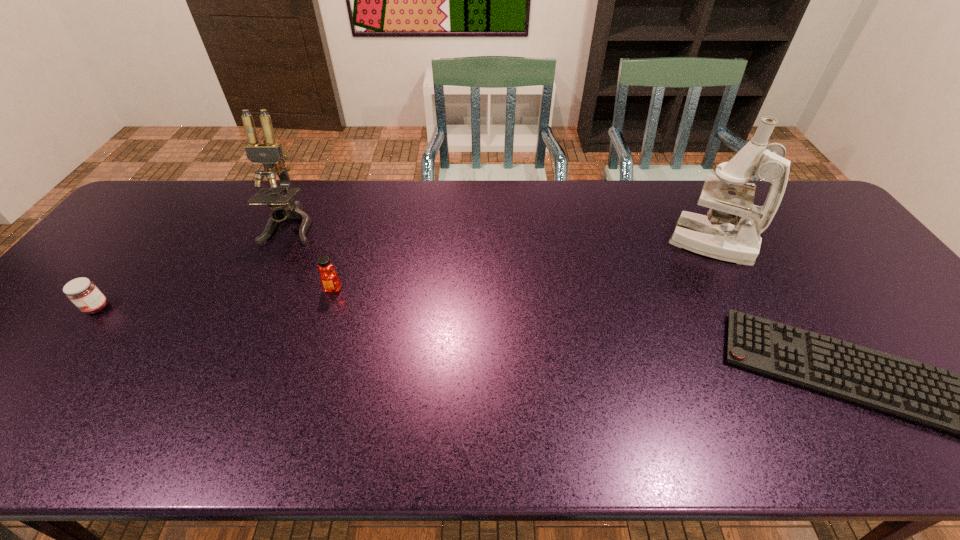
The image size is (960, 540). Identify the location of the right microscope. (713, 236).

Identify the location of the fourth object from right to left. pyautogui.click(x=269, y=153).

At what (x,y) coordinates should I click in order to perform the action: click on the third object from left to right. Please return your answer as a coordinate pair (x, y). The image size is (960, 540). Looking at the image, I should click on (329, 279).

This screenshot has width=960, height=540. I want to click on honey, so click(329, 279).

Identify the location of the fourth tallest object. (83, 293).

This screenshot has width=960, height=540. I want to click on jam, so click(x=83, y=293).

Find the location of a particular element. free region located 0.050m on the front of the right microscope is located at coordinates (730, 279).

This screenshot has height=540, width=960. I want to click on vacant point located at the eyepieces of the fourth object from right to left, so click(239, 335).

Where is `free space located 0.270m on the front label of the third object from left to right`? This screenshot has width=960, height=540. free space located 0.270m on the front label of the third object from left to right is located at coordinates (302, 386).

This screenshot has height=540, width=960. I want to click on free space located on the right of the jam, so click(194, 307).